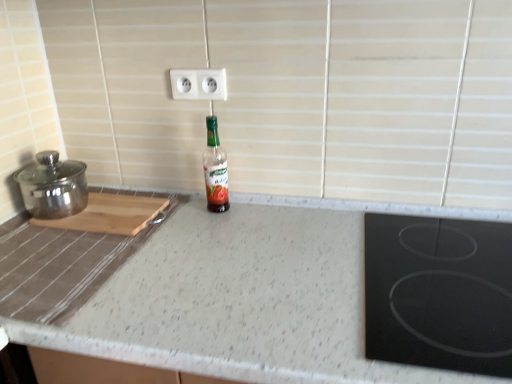
The image size is (512, 384). I want to click on free location to the left of green glass bottle at center, so click(x=170, y=211).